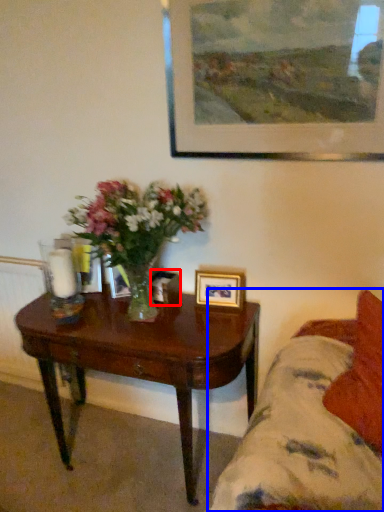
Question: Which point is further to the camera, picture frame (highlighted by a red box) or studio couch (highlighted by a blue box)?

Choices:
 (A) picture frame
 (B) studio couch

Answer: (A)